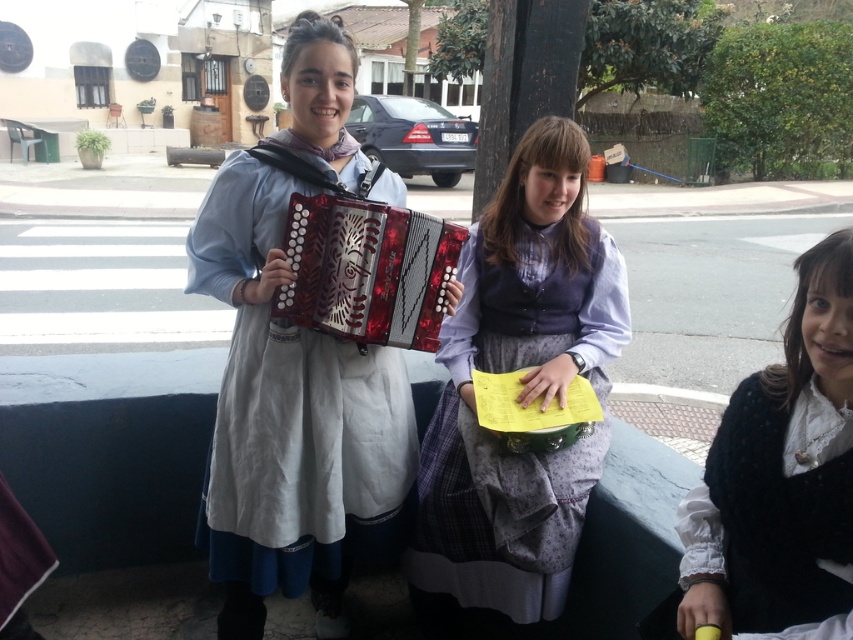
You are a photographer trying to capture the matte black accordion at center and the black fuzzy sweater at lower right in the same frame. Can you see both objects clearly at the same time?

The matte black accordion at center is positioned over the black fuzzy sweater at lower right, so the accordion may block part of the sweater, making it difficult to see both clearly at the same time.

You are a tailor who needs to determine which item requires more fabric for a custom order. Based on the scene, which item has a greater width between the matte purple vest at center and the shiny red wood accordion at center?

The matte purple vest at center has a greater width than the shiny red wood accordion at center, so it would require more fabric for a custom order.